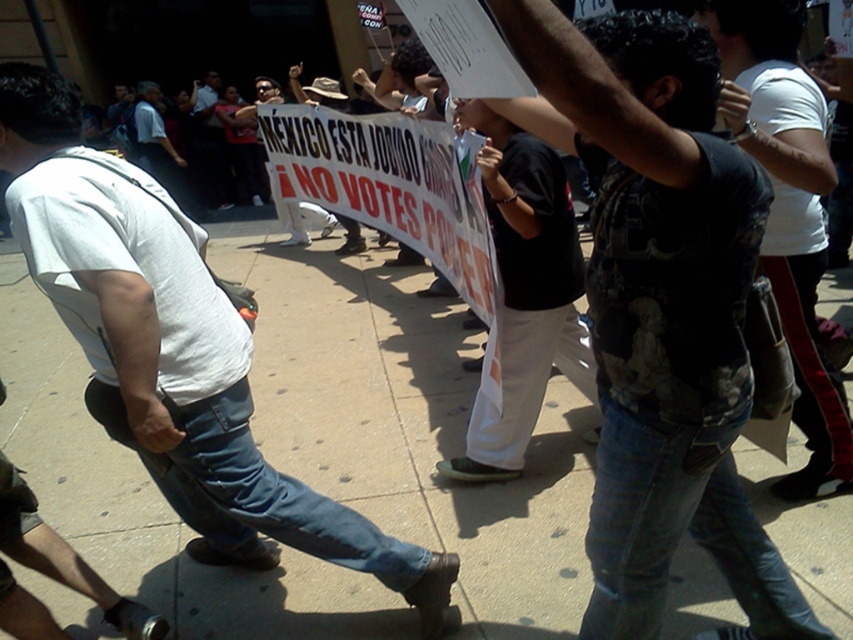
Question: Is smooth concrete sidewalk at center to the right of white t-shirt at center from the viewer's perspective?

Choices:
 (A) yes
 (B) no

Answer: (A)

Question: Which is nearer to the smooth concrete sidewalk at center?

Choices:
 (A) white t-shirt at center
 (B) dark gray t-shirt at center
 (C) dark printed t-shirt at center

Answer: (A)

Question: Can you confirm if smooth concrete sidewalk at center is wider than dark printed t-shirt at center?

Choices:
 (A) yes
 (B) no

Answer: (A)

Question: Does white t-shirt at center appear on the right side of dark gray t-shirt at center?

Choices:
 (A) no
 (B) yes

Answer: (A)

Question: Which point appears farthest from the camera in this image?

Choices:
 (A) (751, 45)
 (B) (173, 326)
 (C) (268, 586)
 (D) (625, 64)

Answer: (C)

Question: Which object appears closest to the camera in this image?

Choices:
 (A) dark printed t-shirt at center
 (B) white t-shirt at center

Answer: (A)